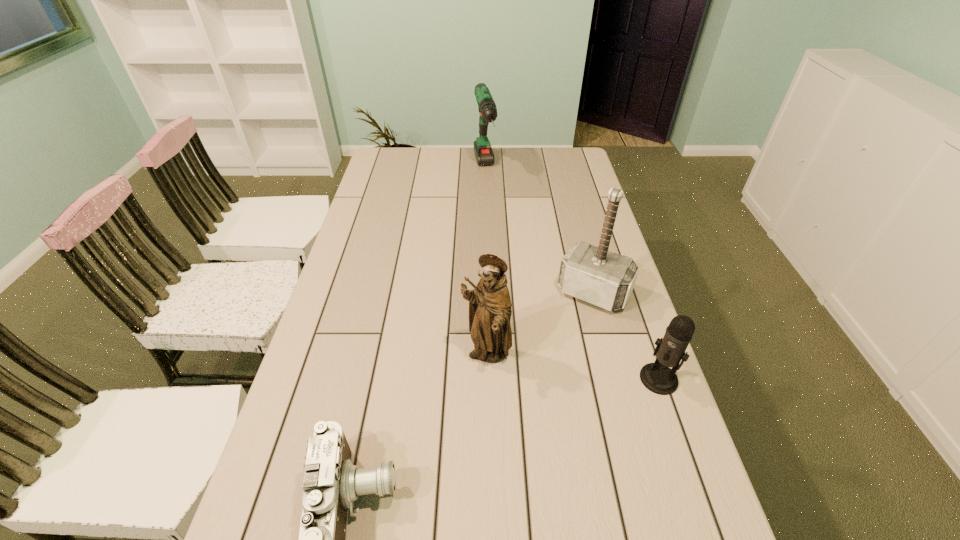
Identify the location of vacant space at the far right corner. Image resolution: width=960 pixels, height=540 pixels. (570, 168).

Where is `vacant region at the near right corner`? vacant region at the near right corner is located at coordinates (659, 506).

This screenshot has height=540, width=960. In order to click on empty space that is in between the fourth nearest object and the drill in this screenshot , I will do `click(539, 231)`.

Find the location of a particular element. This screenshot has width=960, height=540. free space between the fourth nearest object and the figurine is located at coordinates (540, 324).

Find the location of a particular element. This screenshot has height=540, width=960. vacant space that's between the farthest object and the hammer is located at coordinates point(539,231).

Image resolution: width=960 pixels, height=540 pixels. What are the coordinates of `vacant space in between the fourth tallest object and the second farthest object` in the screenshot? It's located at (626, 336).

The height and width of the screenshot is (540, 960). In order to click on vacant area that lies between the fourth tallest object and the second farthest object in this screenshot , I will do `click(626, 336)`.

Locate an element on the screen. This screenshot has height=540, width=960. free point between the second shortest object and the second farthest object is located at coordinates (626, 336).

The width and height of the screenshot is (960, 540). I want to click on vacant area that lies between the hammer and the second shortest object, so click(626, 336).

Select which object appears as the closest to the fourth nearest object. Please provide its 2D coordinates. Your answer should be formatted as a tuple, i.e. [(x, y)], where the tuple contains the x and y coordinates of a point satisfying the conditions above.

[(657, 377)]